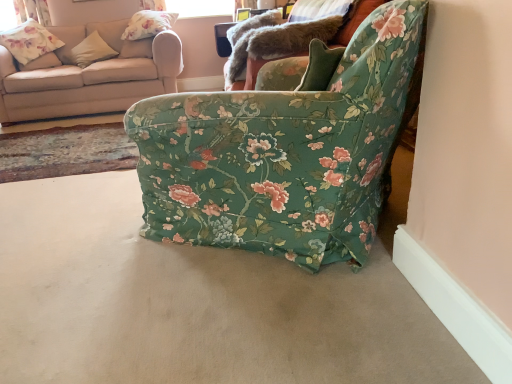
Question: Is floral fabric curtain at upper left bigger than floral fabric pillow at upper left, acting as the second pillow starting from the left?

Choices:
 (A) yes
 (B) no

Answer: (B)

Question: Does floral fabric curtain at upper left have a lesser height compared to floral fabric pillow at upper left, which appears as the first pillow when viewed from the right?

Choices:
 (A) yes
 (B) no

Answer: (B)

Question: Is floral fabric curtain at upper left to the left of floral fabric pillow at upper left, which appears as the first pillow when viewed from the right, from the viewer's perspective?

Choices:
 (A) no
 (B) yes

Answer: (B)

Question: Considering the relative positions of floral fabric curtain at upper left and floral fabric pillow at upper left, which appears as the first pillow when viewed from the right, in the image provided, is floral fabric curtain at upper left to the right of floral fabric pillow at upper left, which appears as the first pillow when viewed from the right, from the viewer's perspective?

Choices:
 (A) no
 (B) yes

Answer: (A)

Question: Is floral fabric curtain at upper left far away from floral fabric pillow at upper left, which appears as the first pillow when viewed from the right?

Choices:
 (A) yes
 (B) no

Answer: (B)

Question: Is floral fabric curtain at upper left turned away from floral fabric pillow at upper left, acting as the second pillow starting from the left?

Choices:
 (A) yes
 (B) no

Answer: (B)

Question: Is floral fabric pillow at upper left further to the viewer compared to beige carpet at lower center?

Choices:
 (A) no
 (B) yes

Answer: (B)

Question: Is floral fabric pillow at upper left with beige carpet at lower center?

Choices:
 (A) yes
 (B) no

Answer: (B)

Question: From the image's perspective, is floral fabric pillow at upper left located above beige carpet at lower center?

Choices:
 (A) no
 (B) yes

Answer: (B)

Question: Are floral fabric pillow at upper left and beige carpet at lower center far apart?

Choices:
 (A) yes
 (B) no

Answer: (A)

Question: Is floral fabric pillow at upper left at the right side of beige carpet at lower center?

Choices:
 (A) yes
 (B) no

Answer: (B)

Question: Considering the relative sizes of floral fabric pillow at upper left and beige carpet at lower center in the image provided, is floral fabric pillow at upper left bigger than beige carpet at lower center?

Choices:
 (A) yes
 (B) no

Answer: (A)

Question: Is floral fabric pillow at upper left, which appears as the first pillow when viewed from the right, with beige fabric couch at upper left?

Choices:
 (A) yes
 (B) no

Answer: (B)